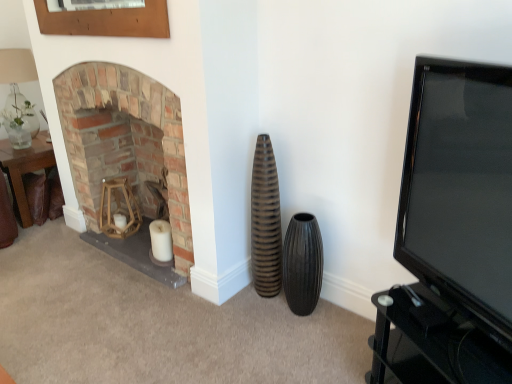
Question: Is translucent glass vase at upper left shorter than wooden frame at upper left?

Choices:
 (A) no
 (B) yes

Answer: (A)

Question: Is translucent glass vase at upper left positioned beyond the bounds of wooden frame at upper left?

Choices:
 (A) yes
 (B) no

Answer: (A)

Question: Is translucent glass vase at upper left positioned far away from wooden frame at upper left?

Choices:
 (A) yes
 (B) no

Answer: (A)

Question: Considering the relative positions of translucent glass vase at upper left and wooden frame at upper left in the image provided, is translucent glass vase at upper left in front of wooden frame at upper left?

Choices:
 (A) yes
 (B) no

Answer: (B)

Question: Does translucent glass vase at upper left appear on the right side of wooden frame at upper left?

Choices:
 (A) no
 (B) yes

Answer: (A)

Question: In the image, is black ribbed vase at center, the 1th vase in the right-to-left sequence, positioned in front of or behind brown leather table at left?

Choices:
 (A) behind
 (B) front

Answer: (B)

Question: Is black ribbed vase at center, the second vase when ordered from left to right, spatially inside brown leather table at left, or outside of it?

Choices:
 (A) outside
 (B) inside

Answer: (A)

Question: In terms of width, does black ribbed vase at center, the second vase when ordered from left to right, look wider or thinner when compared to brown leather table at left?

Choices:
 (A) wide
 (B) thin

Answer: (B)

Question: Does point (309, 231) appear closer or farther from the camera than point (48, 162)?

Choices:
 (A) closer
 (B) farther

Answer: (A)

Question: Is point coord(295,274) closer or farther from the camera than point coord(15,89)?

Choices:
 (A) farther
 (B) closer

Answer: (B)

Question: Is black ribbed vase at center, the 1th vase in the right-to-left sequence, wider or thinner than translucent glass vase at upper left?

Choices:
 (A) thin
 (B) wide

Answer: (A)

Question: Considering the relative positions of black ribbed vase at center, the 1th vase in the right-to-left sequence, and translucent glass vase at upper left in the image provided, is black ribbed vase at center, the 1th vase in the right-to-left sequence, to the left or to the right of translucent glass vase at upper left?

Choices:
 (A) left
 (B) right

Answer: (B)

Question: Is black ribbed vase at center, the 1th vase in the right-to-left sequence, in front of or behind translucent glass vase at upper left in the image?

Choices:
 (A) front
 (B) behind

Answer: (A)

Question: Do you think wooden frame at upper left is within translucent glass vase at upper left, or outside of it?

Choices:
 (A) outside
 (B) inside

Answer: (A)

Question: From their relative heights in the image, would you say wooden frame at upper left is taller or shorter than translucent glass vase at upper left?

Choices:
 (A) short
 (B) tall

Answer: (A)